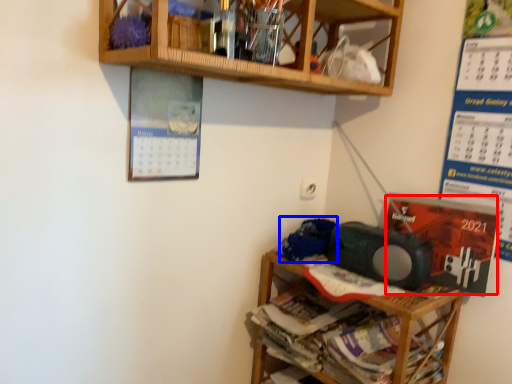
Question: Which object appears farthest to the camera in this image, writing (highlighted by a red box) or waste (highlighted by a blue box)?

Choices:
 (A) writing
 (B) waste

Answer: (B)